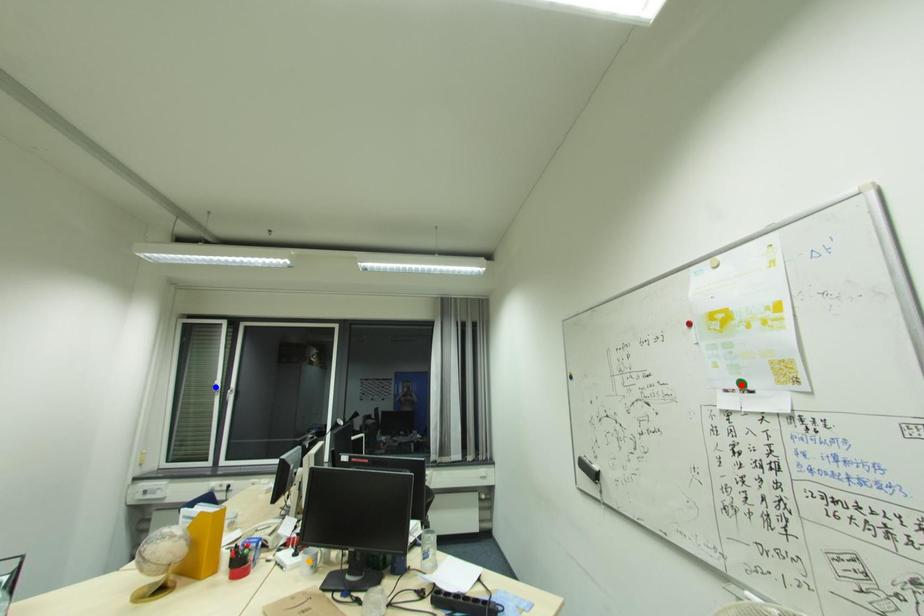
Order these from nearest to farthest:
red point
orange point
blue point

blue point, orange point, red point